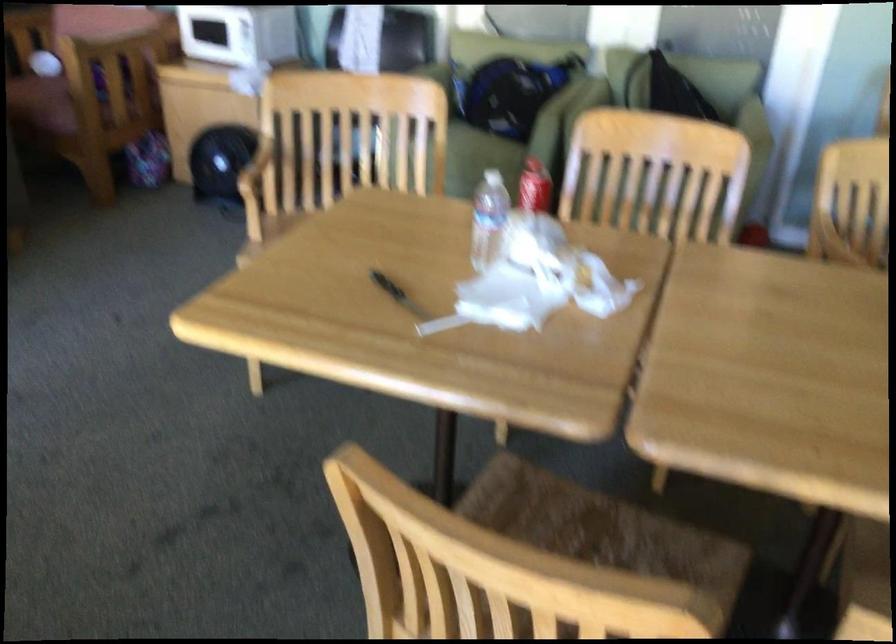
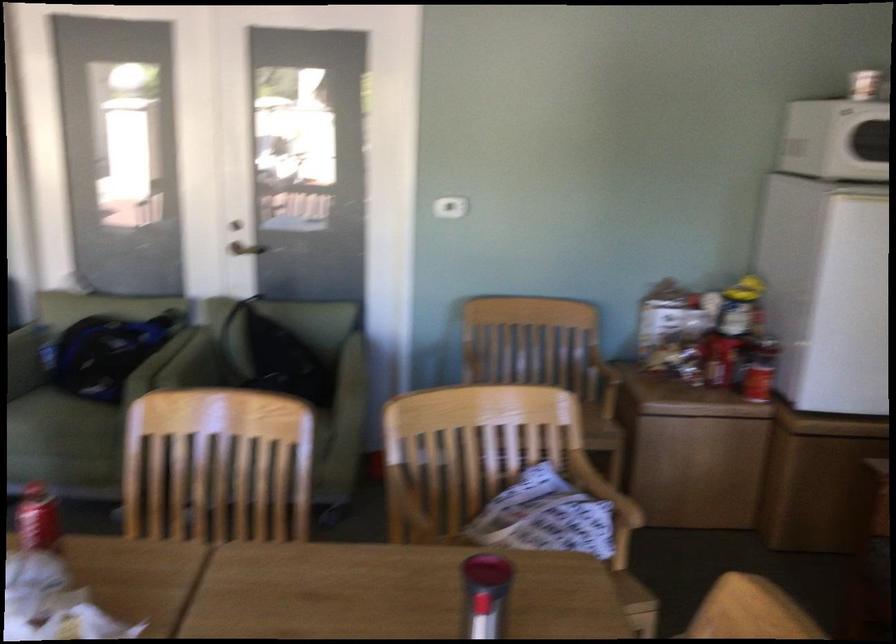
Question: The images are taken continuously from a first-person perspective. In which direction are you moving?

Choices:
 (A) Left
 (B) Right
 (C) Forward
 (D) Backward

Answer: (B)